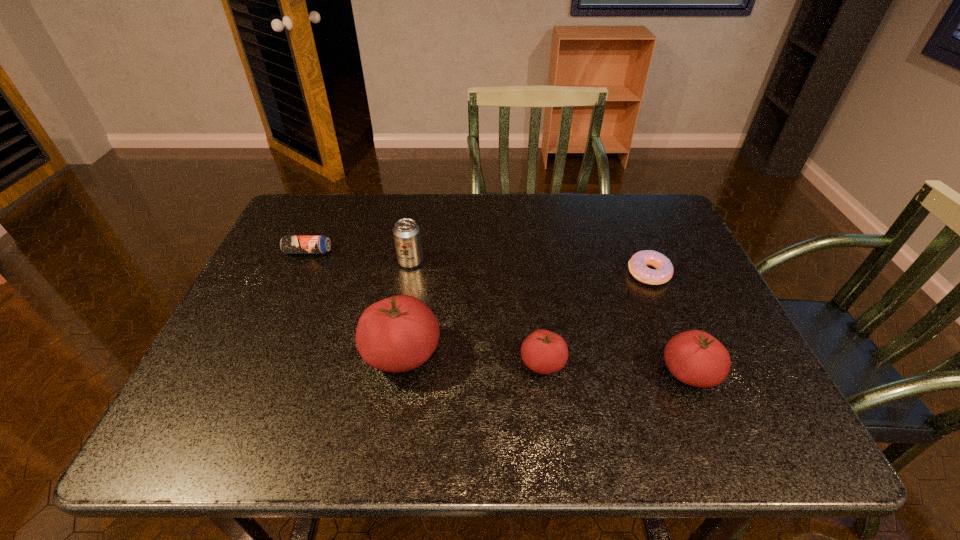
All tomatos are currently evenly spaced. To continue this pattern, where would you add another tomato on the left? Please point out a vacant spot. Please provide its 2D coordinates. Your answer should be formatted as a tuple, i.e. [(x, y)], where the tuple contains the x and y coordinates of a point satisfying the conditions above.

[(266, 345)]